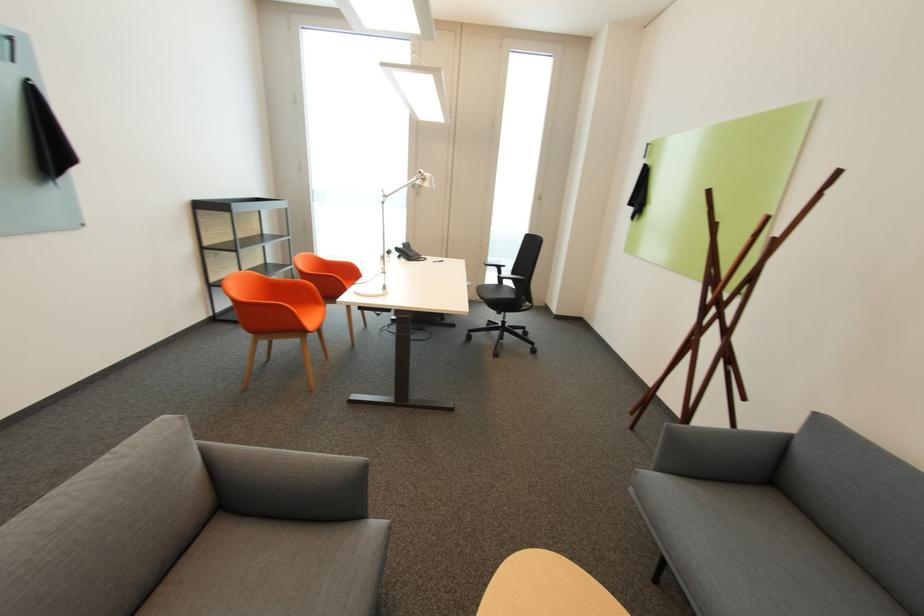
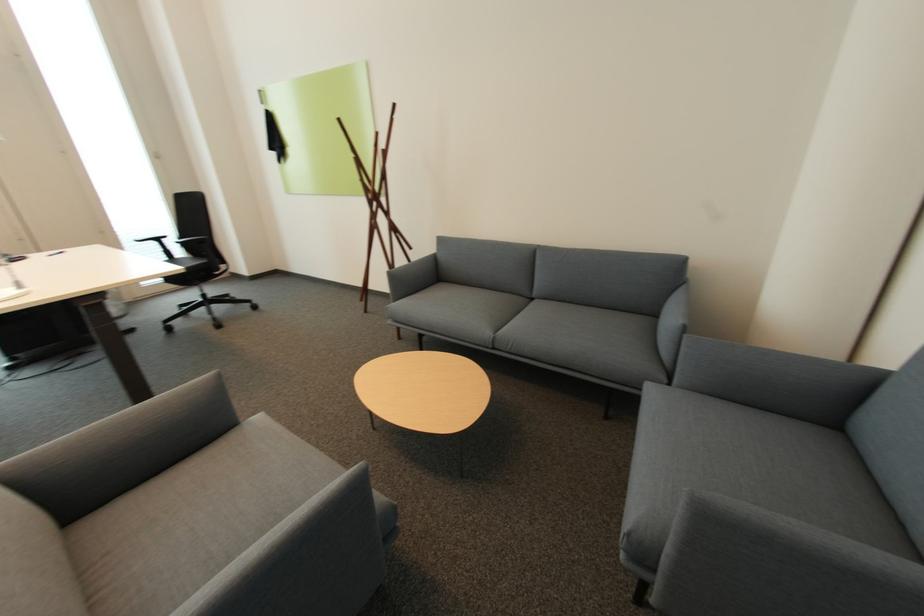
Where in the second image is the point corresponding to point (643, 472) from the first image?

(394, 308)